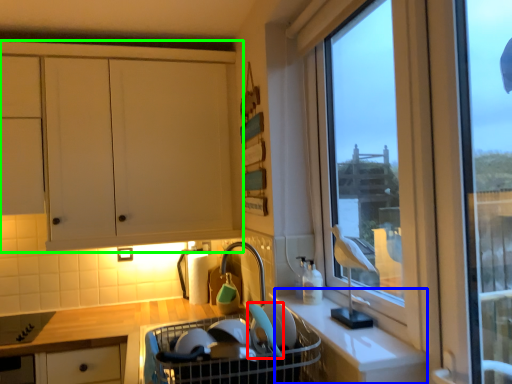
Question: Based on their relative distances, which object is nearer to appliance (highlighted by a red box)? Choose from counter (highlighted by a blue box) and cabinetry (highlighted by a green box).

Choices:
 (A) counter
 (B) cabinetry

Answer: (A)